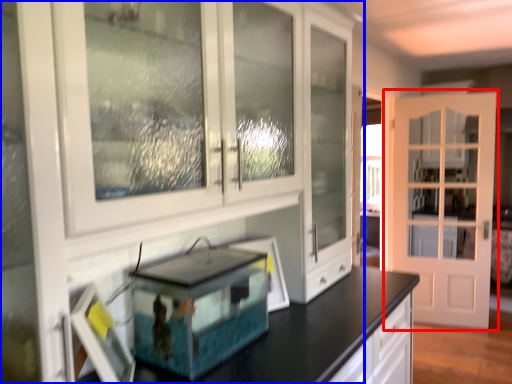
Question: Which of the following is the closest to the observer, door (highlighted by a red box) or cabinetry (highlighted by a blue box)?

Choices:
 (A) door
 (B) cabinetry

Answer: (B)